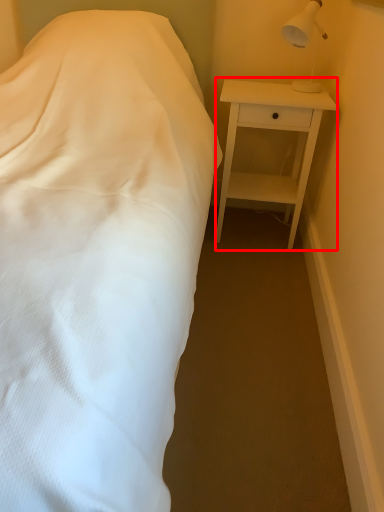
Question: Observing the image, what is the correct spatial positioning of nightstand (annotated by the red box) in reference to lamp?

Choices:
 (A) right
 (B) left

Answer: (B)